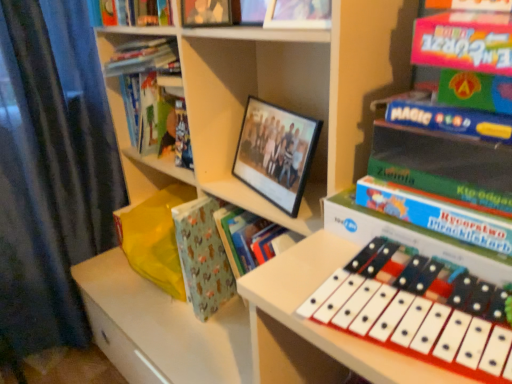
Measure the distance between point (x=136, y=120) and camera.

Point (x=136, y=120) is 4.47 feet from camera.

The width and height of the screenshot is (512, 384). I want to click on black matte picture frame at center, so click(276, 153).

Identify the location of patterned paper at center. tap(202, 256).

The height and width of the screenshot is (384, 512). Find the location of `white plastic musical keyboard at lower right`. white plastic musical keyboard at lower right is located at coordinates (417, 311).

What do you see at coordinates (362, 77) in the screenshot? This screenshot has width=512, height=384. I see `green matte book at right, the 4th book when ordered from back to front` at bounding box center [362, 77].

Where is `hardcover book at upper left, which is counted as the first book, starting from the left`? hardcover book at upper left, which is counted as the first book, starting from the left is located at coordinates (152, 99).

Are white plastic musical keyboard at lower right and black matte picture frame at center far apart?

No, white plastic musical keyboard at lower right is not far away from black matte picture frame at center.

In the scene shown: From the image's perspective, is white plastic musical keyboard at lower right positioned above or below black matte picture frame at center?

From the image's perspective, white plastic musical keyboard at lower right appears below black matte picture frame at center.

From a real-world perspective, is white plastic musical keyboard at lower right beneath black matte picture frame at center?

Yes, from a real-world perspective, white plastic musical keyboard at lower right is under black matte picture frame at center.

Would you say white plastic musical keyboard at lower right is outside black matte picture frame at center?

That's correct, white plastic musical keyboard at lower right is outside of black matte picture frame at center.

Which point is more forward, (339, 152) or (200, 283)?

The point (339, 152) is more forward.

Are green matte book at right, positioned as the first book in right-to-left order, and patterned paper at center located far from each other?

No, green matte book at right, positioned as the first book in right-to-left order, is not far from patterned paper at center.

What's the angular difference between green matte book at right, the fourth book viewed from the left, and patterned paper at center's facing directions?

5.51 degrees separate the facing orientations of green matte book at right, the fourth book viewed from the left, and patterned paper at center.

Which book is the 3rd one when counting from the front of the patterned paper at center? Please provide its 2D coordinates.

[(362, 77)]

Is point (187, 11) in front of point (289, 8)?

No, (187, 11) is behind (289, 8).

Looking at their sizes, would you say matte black photo frame at upper center, the second book in the left-to-right sequence, is wider or thinner than matte plastic photo frame at upper center, positioned as the 2th book in right-to-left order?

matte black photo frame at upper center, the second book in the left-to-right sequence, is wider than matte plastic photo frame at upper center, positioned as the 2th book in right-to-left order.

Is matte black photo frame at upper center, which ranks as the 2th book in back-to-front order, situated inside matte plastic photo frame at upper center, placed as the 3th book when sorted from back to front, or outside?

matte black photo frame at upper center, which ranks as the 2th book in back-to-front order, is not inside matte plastic photo frame at upper center, placed as the 3th book when sorted from back to front, it's outside.

Is the position of matte black photo frame at upper center, the second book in the left-to-right sequence, less distant than that of matte plastic photo frame at upper center, placed as the 3th book when sorted from back to front?

That is False.

Which object is further away from the camera, white plastic musical keyboard at lower right or patterned paper at center?

patterned paper at center is more distant.

From a real-world perspective, is white plastic musical keyboard at lower right positioned above or below patterned paper at center?

white plastic musical keyboard at lower right is situated higher than patterned paper at center in the real world.

Where is `musical keyboard on the right of patterned paper at center`? This screenshot has width=512, height=384. musical keyboard on the right of patterned paper at center is located at coordinates (417, 311).

Could you tell me if white plastic musical keyboard at lower right is turned towards patterned paper at center?

No, white plastic musical keyboard at lower right does not turn towards patterned paper at center.

Looking at this image, from the image's perspective, would you say hardcover book at upper left, the 1th book from the back, is positioned over white plastic musical keyboard at lower right?

Yes.

Considering the relative positions of hardcover book at upper left, which is counted as the first book, starting from the left, and white plastic musical keyboard at lower right in the image provided, is hardcover book at upper left, which is counted as the first book, starting from the left, in front of white plastic musical keyboard at lower right?

No, hardcover book at upper left, which is counted as the first book, starting from the left, is further to the viewer.

Is hardcover book at upper left, which is counted as the first book, starting from the left, with white plastic musical keyboard at lower right?

hardcover book at upper left, which is counted as the first book, starting from the left, and white plastic musical keyboard at lower right are not in contact.

Considering the positions of objects hardcover book at upper left, the 1th book from the back, and white plastic musical keyboard at lower right in the image provided, who is more to the left, hardcover book at upper left, the 1th book from the back, or white plastic musical keyboard at lower right?

Positioned to the left is hardcover book at upper left, the 1th book from the back.

Is hardcover book at upper left, which is counted as the first book, starting from the left, placed right next to patterned paper at center?

No, hardcover book at upper left, which is counted as the first book, starting from the left, is not making contact with patterned paper at center.

Is patterned paper at center completely or partially inside hardcover book at upper left, the 4th book from the right?

No, patterned paper at center is not surrounded by hardcover book at upper left, the 4th book from the right.

Is hardcover book at upper left, the 1th book from the back, taller or shorter than patterned paper at center?

In the image, hardcover book at upper left, the 1th book from the back, appears to be shorter than patterned paper at center.

How different are the orientations of hardcover book at upper left, the 1th book from the back, and patterned paper at center in degrees?

The facing directions of hardcover book at upper left, the 1th book from the back, and patterned paper at center are 8.21 degrees apart.

Which is less distant, (212, 3) or (252, 129)?

Point (212, 3) is positioned closer to the camera compared to point (252, 129).

Is matte black photo frame at upper center, the second book in the left-to-right sequence, positioned behind black matte picture frame at center?

Yes, the depth of matte black photo frame at upper center, the second book in the left-to-right sequence, is greater than that of black matte picture frame at center.

From the image's perspective, which one is positioned higher, matte black photo frame at upper center, which appears as the third book when viewed from the front, or black matte picture frame at center?

matte black photo frame at upper center, which appears as the third book when viewed from the front, is shown above in the image.

From a real-world perspective, starting from the black matte picture frame at center, which book is the 4th one vertically above it? Please provide its 2D coordinates.

[(206, 13)]

The image size is (512, 384). I want to click on picture frame above the white plastic musical keyboard at lower right (from the image's perspective), so click(x=276, y=153).

Locate an element on the screen. paperback book below the green matte book at right, the fourth book viewed from the left (from the image's perspective) is located at coordinates (202, 256).

Estimate the real-world distances between objects in this image. Which object is further from patterned paper at center, white plastic musical keyboard at lower right or matte black photo frame at upper center, which ranks as the 2th book in back-to-front order?

white plastic musical keyboard at lower right lies further to patterned paper at center than the other object.

Looking at this image, looking at the image, which one is located closer to white plastic musical keyboard at lower right, matte black photo frame at upper center, the 3th book from the right, or patterned paper at center?

patterned paper at center lies closer to white plastic musical keyboard at lower right than the other object.

Based on their spatial positions, is matte black photo frame at upper center, the second book in the left-to-right sequence, or black matte picture frame at center closer to white plastic musical keyboard at lower right?

Among the two, black matte picture frame at center is located nearer to white plastic musical keyboard at lower right.

When comparing their distances from matte plastic photo frame at upper center, placed as the 2th book when sorted from front to back, does patterned paper at center or hardcover book at upper left, the 4th book from the right, seem closer?

hardcover book at upper left, the 4th book from the right.

Considering their positions, is patterned paper at center positioned closer to black matte picture frame at center than white plastic musical keyboard at lower right?

Based on the image, patterned paper at center appears to be nearer to black matte picture frame at center.

Which object lies further to the anchor point matte plastic photo frame at upper center, which ranks as the third book in left-to-right order, black matte picture frame at center or white plastic musical keyboard at lower right?

A: Based on the image, white plastic musical keyboard at lower right appears to be further to matte plastic photo frame at upper center, which ranks as the third book in left-to-right order.

When comparing their distances from matte plastic photo frame at upper center, placed as the 3th book when sorted from back to front, does patterned paper at center or green matte book at right, marked as the 1th book in a front-to-back arrangement, seem closer?

Based on the image, green matte book at right, marked as the 1th book in a front-to-back arrangement, appears to be nearer to matte plastic photo frame at upper center, placed as the 3th book when sorted from back to front.

Considering their positions, is patterned paper at center positioned closer to matte black photo frame at upper center, which ranks as the 2th book in back-to-front order, than black matte picture frame at center?

black matte picture frame at center is closer to matte black photo frame at upper center, which ranks as the 2th book in back-to-front order.

The height and width of the screenshot is (384, 512). Find the location of `book between matte black photo frame at upper center, the 3th book from the right, and green matte book at right, positioned as the first book in right-to-left order, in the horizontal direction`. book between matte black photo frame at upper center, the 3th book from the right, and green matte book at right, positioned as the first book in right-to-left order, in the horizontal direction is located at coordinates (298, 14).

The image size is (512, 384). I want to click on picture frame between white plastic musical keyboard at lower right and hardcover book at upper left, marked as the fourth book in a front-to-back arrangement, along the z-axis, so click(x=276, y=153).

Where is `picture frame between matte plastic photo frame at upper center, which ranks as the third book in left-to-right order, and white plastic musical keyboard at lower right from top to bottom`? picture frame between matte plastic photo frame at upper center, which ranks as the third book in left-to-right order, and white plastic musical keyboard at lower right from top to bottom is located at coordinates (276, 153).

Where is `picture frame between matte plastic photo frame at upper center, placed as the 3th book when sorted from back to front, and patterned paper at center vertically`? The height and width of the screenshot is (384, 512). picture frame between matte plastic photo frame at upper center, placed as the 3th book when sorted from back to front, and patterned paper at center vertically is located at coordinates (276, 153).